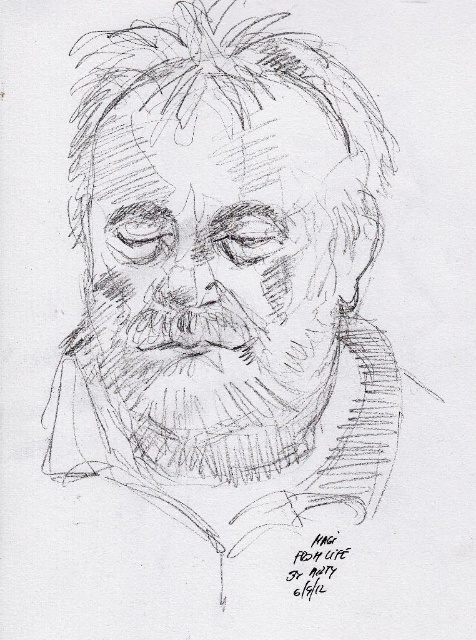
The height and width of the screenshot is (640, 476). What do you see at coordinates (214, 291) in the screenshot?
I see `pencil sketch face at center` at bounding box center [214, 291].

From the picture: Is the position of pencil sketch face at center more distant than that of shaggy pencil beard at center?

No, it is in front of shaggy pencil beard at center.

Does point (232, 202) lie behind point (139, 346)?

No, (232, 202) is in front of (139, 346).

The image size is (476, 640). Find the location of `pencil sketch face at center`. pencil sketch face at center is located at coordinates (214, 291).